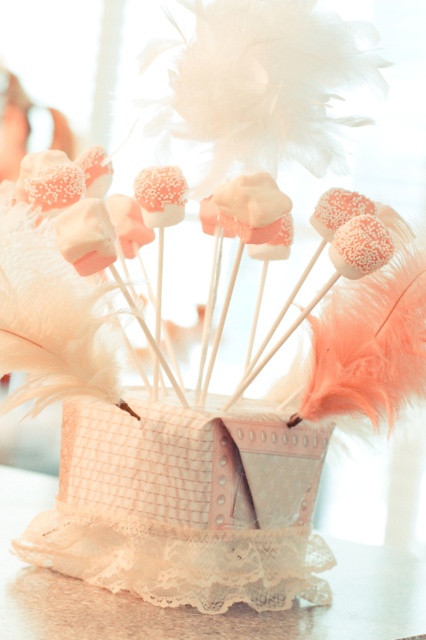
Is coral marshmallow at center smaller than lace fabric at lower center?

Correct, coral marshmallow at center occupies less space than lace fabric at lower center.

Does point (48, 296) come in front of point (235, 621)?

Yes, point (48, 296) is closer to viewer.

Is point (239, 392) farther from viewer compared to point (199, 637)?

That is True.

What are the coordinates of `coral marshmallow at center` in the screenshot? It's located at (62, 312).